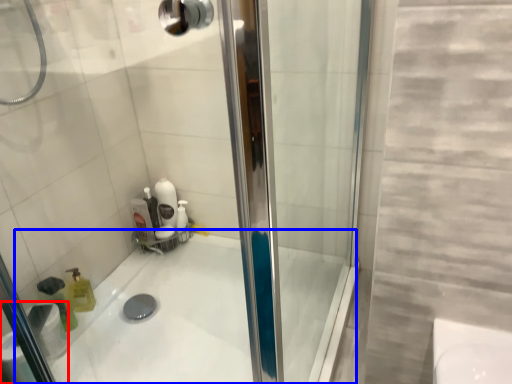
Question: Which point is closer to the camera, toilet paper (highlighted by a red box) or bath (highlighted by a blue box)?

Choices:
 (A) toilet paper
 (B) bath

Answer: (B)